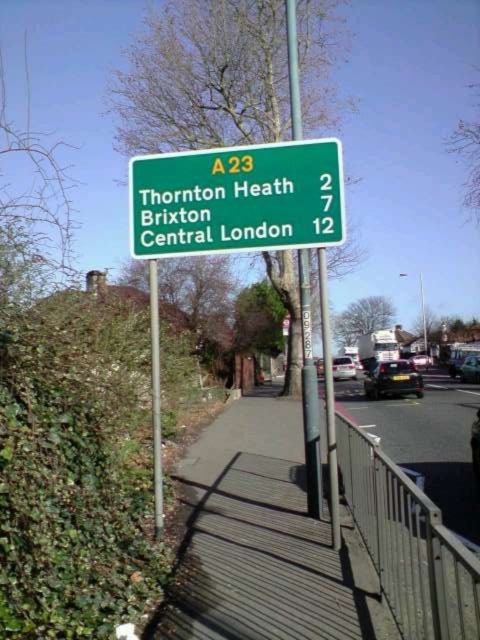
Question: Can you confirm if wooden at center is wider than metallic silver car at center right?

Choices:
 (A) yes
 (B) no

Answer: (A)

Question: Which object appears farthest from the camera in this image?

Choices:
 (A) metallic gray railing at lower right
 (B) dark gray wooden pavement at center
 (C) wooden at center

Answer: (C)

Question: Can you confirm if green plastic sign at upper center is positioned above metallic silver car at center right?

Choices:
 (A) yes
 (B) no

Answer: (A)

Question: Which of the following is the farthest from the observer?

Choices:
 (A) silver metallic van at center
 (B) metallic gray railing at lower right
 (C) wooden at center

Answer: (A)

Question: Can you confirm if green metallic signpost at upper center is bigger than black glossy car at center?

Choices:
 (A) yes
 (B) no

Answer: (B)

Question: Which object is positioned farthest from the green metallic pole at center?

Choices:
 (A) black glossy car at center
 (B) green metallic signpost at upper center

Answer: (A)